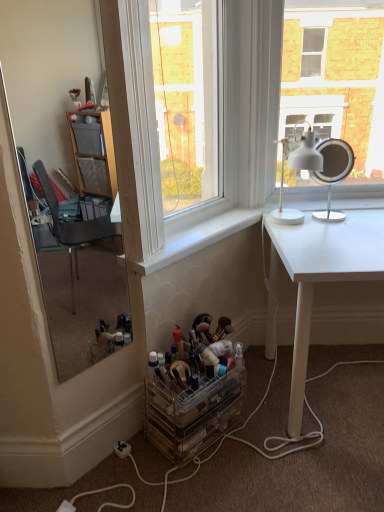
Locate an element on the screen. This screenshot has height=512, width=384. clear acrylic makeup organizer at lower center is located at coordinates (192, 413).

What do you see at coordinates (325, 168) in the screenshot? I see `white plastic table lamp at upper right, which is counted as the second table lamp, starting from the left` at bounding box center [325, 168].

What is the approximate height of clear plastic makeup organizer at lower left?

The height of clear plastic makeup organizer at lower left is 6.69 inches.

What do you see at coordinates (141, 134) in the screenshot? This screenshot has width=384, height=512. I see `clear glass window at center` at bounding box center [141, 134].

Image resolution: width=384 pixels, height=512 pixels. I want to click on clear glass mirror at left, so click(x=58, y=92).

The image size is (384, 512). What are the coordinates of `white matte table lamp at upper right, the second table lamp positioned from the right` in the screenshot? It's located at (306, 153).

In the scene shown: Can you confirm if white plastic power outlet at lower center is positioned to the left of clear glass window at center?

Yes, white plastic power outlet at lower center is to the left of clear glass window at center.

In the scene shown: Is white plastic power outlet at lower center taller than clear glass window at center?

No, white plastic power outlet at lower center is not taller than clear glass window at center.

Is the depth of white plastic power outlet at lower center greater than that of clear glass window at center?

Yes, white plastic power outlet at lower center is further from the camera.

Is clear plastic makeup organizer at lower left oriented away from clear acrylic makeup organizer at lower center?

clear plastic makeup organizer at lower left is not turned away from clear acrylic makeup organizer at lower center.

Looking at the image, does clear plastic makeup organizer at lower left seem bigger or smaller compared to clear acrylic makeup organizer at lower center?

In the image, clear plastic makeup organizer at lower left appears to be smaller than clear acrylic makeup organizer at lower center.

From a real-world perspective, which object stands above the other?

clear plastic makeup organizer at lower left.

Considering the sizes of clear plastic makeup organizer at lower left and clear acrylic makeup organizer at lower center in the image, is clear plastic makeup organizer at lower left taller or shorter than clear acrylic makeup organizer at lower center?

In the image, clear plastic makeup organizer at lower left appears to be shorter than clear acrylic makeup organizer at lower center.

What's the angular difference between white plastic table lamp at upper right, which is counted as the first table lamp, starting from the right, and clear glass mirror at left's facing directions?

The facing directions of white plastic table lamp at upper right, which is counted as the first table lamp, starting from the right, and clear glass mirror at left are 45 degrees apart.

Would you consider white plastic table lamp at upper right, which is counted as the first table lamp, starting from the right, to be distant from clear glass mirror at left?

Yes.

Is white plastic table lamp at upper right, which is counted as the second table lamp, starting from the left, aimed at clear glass mirror at left?

No, white plastic table lamp at upper right, which is counted as the second table lamp, starting from the left, is not oriented towards clear glass mirror at left.

Can you confirm if white plastic table lamp at upper right, which is counted as the second table lamp, starting from the left, is thinner than clear glass mirror at left?

In fact, white plastic table lamp at upper right, which is counted as the second table lamp, starting from the left, might be wider than clear glass mirror at left.

In the scene shown: How many degrees apart are the facing directions of white matte table lamp at upper right, the 1th table lamp positioned from the left, and white matte desk at right?

The angular difference between white matte table lamp at upper right, the 1th table lamp positioned from the left, and white matte desk at right is 4.79 degrees.

Between point (309, 150) and point (343, 234), which one is positioned in front?

Point (309, 150)

From a real-world perspective, is white matte table lamp at upper right, the 1th table lamp positioned from the left, above or below white matte desk at right?

Clearly, from a real-world perspective, white matte table lamp at upper right, the 1th table lamp positioned from the left, is above white matte desk at right.

Consider the image. Can you confirm if white matte table lamp at upper right, the 1th table lamp positioned from the left, is positioned to the right of white matte desk at right?

In fact, white matte table lamp at upper right, the 1th table lamp positioned from the left, is to the left of white matte desk at right.

Is white plastic table lamp at upper right, which is counted as the first table lamp, starting from the right, oriented towards clear plastic makeup organizer at lower left?

No, white plastic table lamp at upper right, which is counted as the first table lamp, starting from the right, is not aimed at clear plastic makeup organizer at lower left.

Can you confirm if white plastic table lamp at upper right, which is counted as the first table lamp, starting from the right, is wider than clear plastic makeup organizer at lower left?

No, white plastic table lamp at upper right, which is counted as the first table lamp, starting from the right, is not wider than clear plastic makeup organizer at lower left.

Are white plastic table lamp at upper right, which is counted as the first table lamp, starting from the right, and clear plastic makeup organizer at lower left located far from each other?

They are positioned close to each other.

Based on the photo, does white plastic table lamp at upper right, which is counted as the second table lamp, starting from the left, have a greater height compared to white plastic power outlet at lower center?

Correct, white plastic table lamp at upper right, which is counted as the second table lamp, starting from the left, is much taller as white plastic power outlet at lower center.

Considering the positions of objects white plastic table lamp at upper right, which is counted as the second table lamp, starting from the left, and white plastic power outlet at lower center in the image provided, who is behind, white plastic table lamp at upper right, which is counted as the second table lamp, starting from the left, or white plastic power outlet at lower center?

Positioned behind is white plastic table lamp at upper right, which is counted as the second table lamp, starting from the left.

Could you tell me if white plastic table lamp at upper right, which is counted as the first table lamp, starting from the right, is facing white plastic power outlet at lower center?

No, white plastic table lamp at upper right, which is counted as the first table lamp, starting from the right, is not oriented towards white plastic power outlet at lower center.

Can you see white plastic table lamp at upper right, which is counted as the second table lamp, starting from the left, touching white plastic power outlet at lower center?

No, white plastic table lamp at upper right, which is counted as the second table lamp, starting from the left, is not with white plastic power outlet at lower center.

Who is bigger, clear plastic makeup organizer at lower left or white plastic table lamp at upper right, which is counted as the first table lamp, starting from the right?

clear plastic makeup organizer at lower left is bigger.

From a real-world perspective, is clear plastic makeup organizer at lower left physically located above or below white plastic table lamp at upper right, which is counted as the second table lamp, starting from the left?

From a real-world perspective, clear plastic makeup organizer at lower left is physically below white plastic table lamp at upper right, which is counted as the second table lamp, starting from the left.

From the image's perspective, is clear plastic makeup organizer at lower left above white plastic table lamp at upper right, which is counted as the first table lamp, starting from the right?

Incorrect, from the image's perspective, clear plastic makeup organizer at lower left is lower than white plastic table lamp at upper right, which is counted as the first table lamp, starting from the right.

Identify the location of power outlet below the clear glass window at center (from a real-world perspective). This screenshot has width=384, height=512. (122, 449).

Identify the location of shelf below the clear plastic makeup organizer at lower left (from the image's perspective). (192, 413).

From the picture: From the image, which object appears to be nearer to white smooth window sill at center, white matte desk at right or clear glass mirror at left?

white matte desk at right is positioned closer to the anchor white smooth window sill at center.

Based on their spatial positions, is white matte desk at right or white smooth window sill at center closer to clear plastic makeup organizer at lower left?

The object closer to clear plastic makeup organizer at lower left is white smooth window sill at center.

Looking at the image, which one is located closer to clear plastic makeup organizer at lower left, clear glass window at center or white smooth window sill at center?

The object closer to clear plastic makeup organizer at lower left is white smooth window sill at center.

Looking at the image, which one is located further to clear acrylic makeup organizer at lower center, white smooth window sill at center or white plastic table lamp at upper right, which is counted as the second table lamp, starting from the left?

white plastic table lamp at upper right, which is counted as the second table lamp, starting from the left, lies further to clear acrylic makeup organizer at lower center than the other object.

Considering their positions, is white plastic power outlet at lower center positioned closer to clear glass mirror at left than white matte desk at right?

Based on the image, white matte desk at right appears to be nearer to clear glass mirror at left.

Estimate the real-world distances between objects in this image. Which object is closer to white matte table lamp at upper right, the second table lamp positioned from the right, clear plastic makeup organizer at lower left or clear glass window at center?

clear glass window at center lies closer to white matte table lamp at upper right, the second table lamp positioned from the right, than the other object.

From the picture: Looking at the image, which one is located further to clear acrylic makeup organizer at lower center, white plastic table lamp at upper right, which is counted as the second table lamp, starting from the left, or white matte desk at right?

Among the two, white plastic table lamp at upper right, which is counted as the second table lamp, starting from the left, is located further to clear acrylic makeup organizer at lower center.

Which object lies further to the anchor point clear acrylic makeup organizer at lower center, white matte desk at right or white smooth window sill at center?

Based on the image, white smooth window sill at center appears to be further to clear acrylic makeup organizer at lower center.

Locate an element on the screen. The image size is (384, 512). table lamp between white matte table lamp at upper right, the second table lamp positioned from the right, and clear acrylic makeup organizer at lower center in the up-down direction is located at coordinates (325, 168).

Locate an element on the screen. This screenshot has height=512, width=384. window sill between clear glass window at center and white matte table lamp at upper right, the 1th table lamp positioned from the left, in the horizontal direction is located at coordinates (198, 238).

Locate an element on the screen. This screenshot has width=384, height=512. toy between clear glass mirror at left and clear acrylic makeup organizer at lower center vertically is located at coordinates (199, 357).

Image resolution: width=384 pixels, height=512 pixels. Find the location of `window sill between clear glass mirror at left and white plastic power outlet at lower center vertically`. window sill between clear glass mirror at left and white plastic power outlet at lower center vertically is located at coordinates (198, 238).